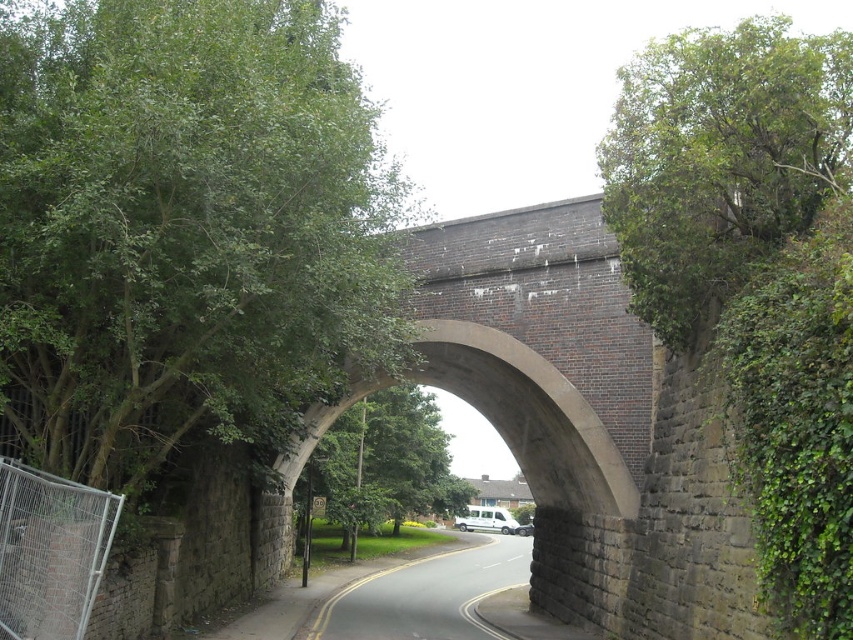
Question: Does green leafy tree at upper right appear on the left side of green leafy tree at center?

Choices:
 (A) no
 (B) yes

Answer: (A)

Question: In this image, where is green leafy tree at upper left located relative to green leafy tree at upper right?

Choices:
 (A) below
 (B) above

Answer: (A)

Question: Which point appears farthest from the camera in this image?

Choices:
 (A) (328, 467)
 (B) (784, 141)
 (C) (24, 221)

Answer: (A)

Question: Is green leafy tree at upper left smaller than green leafy tree at upper right?

Choices:
 (A) no
 (B) yes

Answer: (B)

Question: Which object is the closest to the green leafy tree at center?

Choices:
 (A) green leafy tree at upper right
 (B) green leafy tree at upper left

Answer: (B)

Question: Which point is closer to the camera?

Choices:
 (A) green leafy tree at center
 (B) green leafy tree at upper right
 (C) green leafy tree at upper left

Answer: (C)